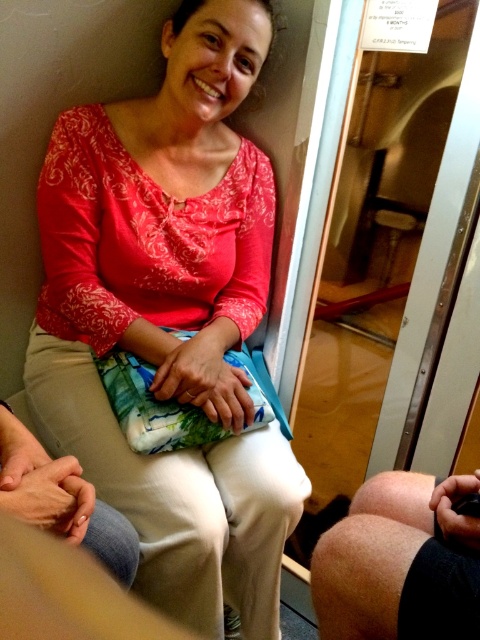
Question: Is matte red blouse at center behind smooth skin knee at lower right?

Choices:
 (A) yes
 (B) no

Answer: (A)

Question: Is matte red blouse at center further to the viewer compared to smooth skin knee at lower right?

Choices:
 (A) yes
 (B) no

Answer: (A)

Question: Among these points, which one is farthest from the camera?

Choices:
 (A) (415, 520)
 (B) (172, 67)

Answer: (B)

Question: Can you confirm if matte red blouse at center is thinner than smooth skin knee at lower right?

Choices:
 (A) no
 (B) yes

Answer: (A)

Question: Which of the following is the closest to the observer?

Choices:
 (A) (158, 340)
 (B) (372, 580)

Answer: (B)

Question: Among these points, which one is nearest to the camera?

Choices:
 (A) (113, 205)
 (B) (446, 564)

Answer: (B)